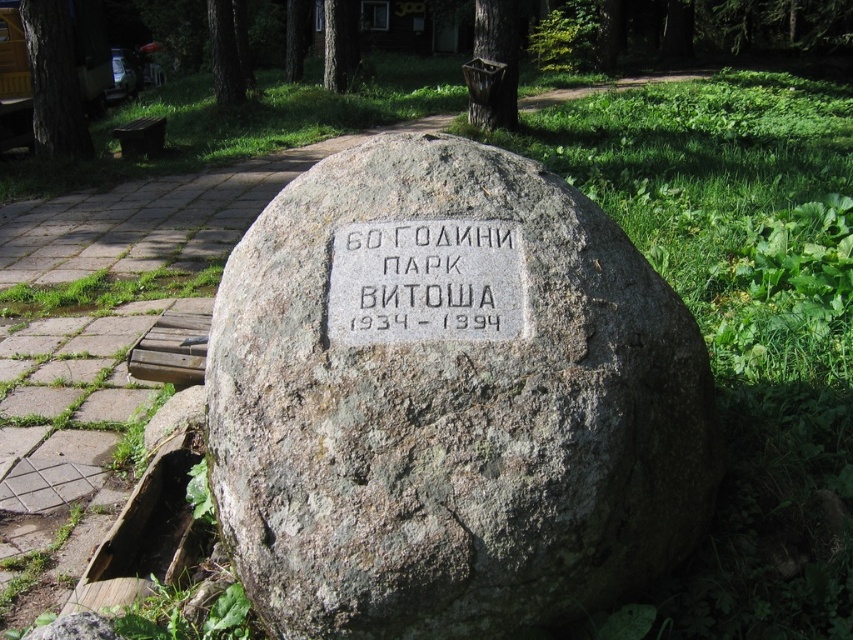
You are standing in front of the monument and want to place a wreath at the point closest to you. Which point should you choose between point [451,250] and point [502,99]?

Point [451,250] is in front of point [502,99], so you should choose point [451,250] to place the wreath as it is closer to you.

What is the purpose of the point at coordinates [425,282] on the gray stone monument?

The point at coordinates [425,282] on the gray stone monument indicates the location of the engraved plaque commemorating the 60th anniversary of Park Vitosha from 1934 to 1994.